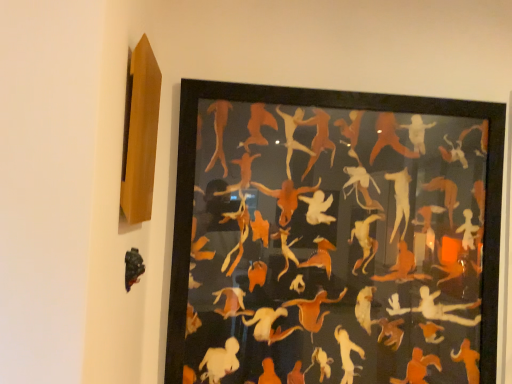
Question: Considering the positions of black matte sculpture at lower left and orange matte paper cutouts at center in the image, is black matte sculpture at lower left taller or shorter than orange matte paper cutouts at center?

Choices:
 (A) short
 (B) tall

Answer: (A)

Question: Choose the correct answer: Is black matte sculpture at lower left inside orange matte paper cutouts at center or outside it?

Choices:
 (A) inside
 (B) outside

Answer: (B)

Question: Considering the positions of black matte sculpture at lower left and orange matte paper cutouts at center in the image, is black matte sculpture at lower left wider or thinner than orange matte paper cutouts at center?

Choices:
 (A) thin
 (B) wide

Answer: (A)

Question: From a real-world perspective, is orange matte paper cutouts at center physically located above or below black matte sculpture at lower left?

Choices:
 (A) above
 (B) below

Answer: (A)

Question: Would you say orange matte paper cutouts at center is to the left or to the right of black matte sculpture at lower left in the picture?

Choices:
 (A) right
 (B) left

Answer: (A)

Question: In the image, is orange matte paper cutouts at center positioned in front of or behind black matte sculpture at lower left?

Choices:
 (A) behind
 (B) front

Answer: (A)

Question: Is orange matte paper cutouts at center wider or thinner than black matte sculpture at lower left?

Choices:
 (A) wide
 (B) thin

Answer: (A)